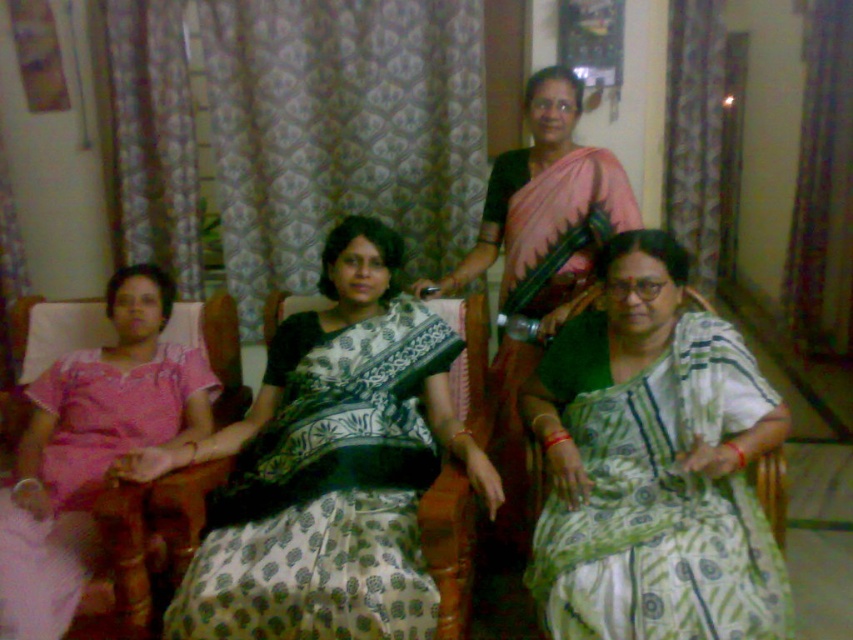
You are standing in the living room and want to hand a gift to the person wearing the white printed fabric dress at center. Based on their position relative to the other women, which direction should you approach from?

The white printed fabric dress at center is located at point (326, 492), so you should approach from the right side since the coordinates indicate it is positioned more to the right in the room.